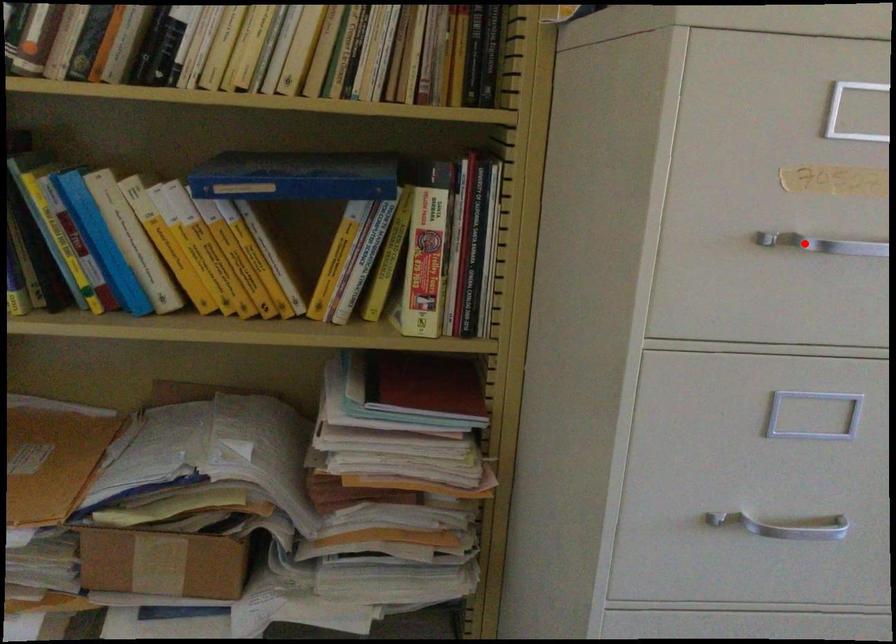
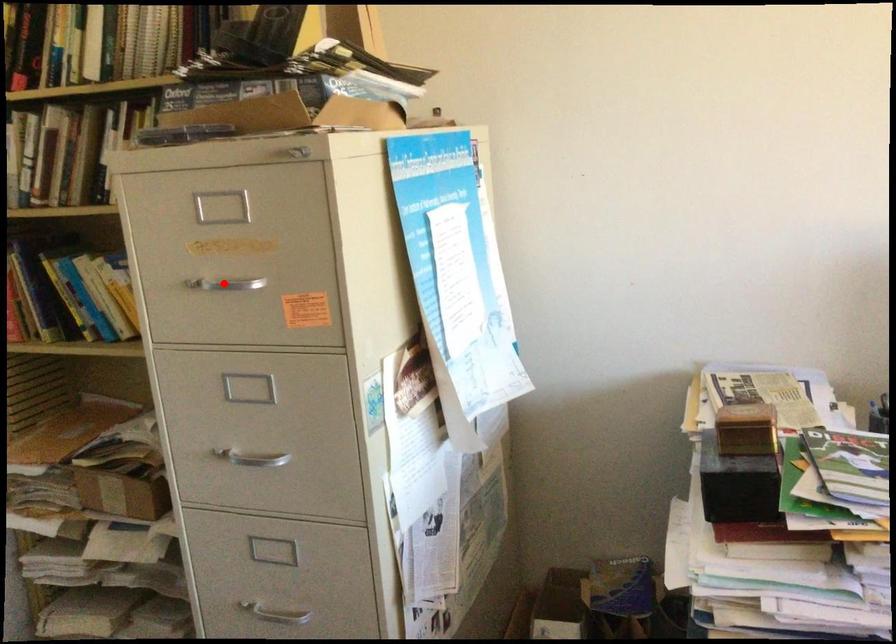
I am providing you with two images of the same scene from different viewpoints. A red point is marked on the first image and another point is marked on the second image. Do the highlighted points in image1 and image2 indicate the same real-world spot?

Yes